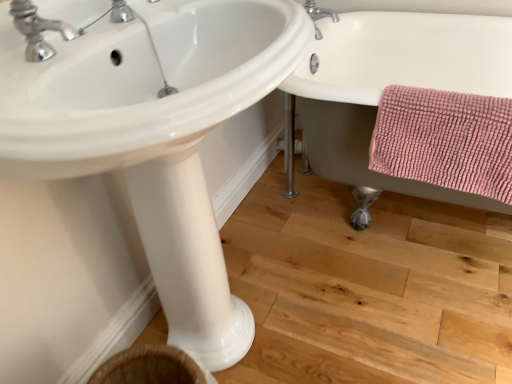
Question: Is white ceramic bathtub at right positioned beyond the bounds of pink chenille bath towel at lower right?

Choices:
 (A) no
 (B) yes

Answer: (B)

Question: Considering the relative sizes of white ceramic bathtub at right and pink chenille bath towel at lower right in the image provided, is white ceramic bathtub at right bigger than pink chenille bath towel at lower right?

Choices:
 (A) yes
 (B) no

Answer: (A)

Question: Could you tell me if white ceramic bathtub at right is facing pink chenille bath towel at lower right?

Choices:
 (A) no
 (B) yes

Answer: (B)

Question: Does white ceramic bathtub at right have a greater width compared to pink chenille bath towel at lower right?

Choices:
 (A) yes
 (B) no

Answer: (A)

Question: Is white ceramic bathtub at right shorter than pink chenille bath towel at lower right?

Choices:
 (A) no
 (B) yes

Answer: (A)

Question: Is white ceramic bathtub at right positioned in front of pink chenille bath towel at lower right?

Choices:
 (A) no
 (B) yes

Answer: (B)

Question: From a real-world perspective, is chrome metallic faucet at upper left, the second tap from the right, beneath white glossy sink at center?

Choices:
 (A) no
 (B) yes

Answer: (A)

Question: Could you tell me if chrome metallic faucet at upper left, the second tap from the top, is turned towards white glossy sink at center?

Choices:
 (A) yes
 (B) no

Answer: (B)

Question: Is white glossy sink at center completely or partially inside chrome metallic faucet at upper left, which is the 1th tap in front-to-back order?

Choices:
 (A) no
 (B) yes

Answer: (A)

Question: Is chrome metallic faucet at upper left, the second tap from the top, positioned far away from white glossy sink at center?

Choices:
 (A) no
 (B) yes

Answer: (A)

Question: Is chrome metallic faucet at upper left, the first tap from the left, not inside white glossy sink at center?

Choices:
 (A) no
 (B) yes

Answer: (A)

Question: From the image's perspective, does chrome metallic faucet at upper left, the first tap positioned from the bottom, appear higher than white glossy sink at center?

Choices:
 (A) no
 (B) yes

Answer: (B)

Question: From the image's perspective, is white ceramic bathtub at right above white glossy pedestal at center?

Choices:
 (A) no
 (B) yes

Answer: (B)